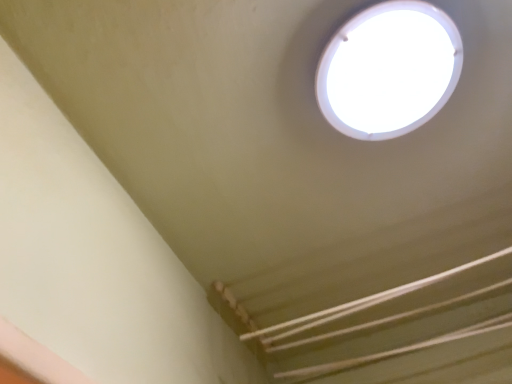
Image resolution: width=512 pixels, height=384 pixels. Describe the element at coordinates (389, 70) in the screenshot. I see `transparent glass window at upper right` at that location.

At what (x,y) coordinates should I click in order to perform the action: click on transparent glass window at upper right. Please return your answer as a coordinate pair (x, y). Looking at the image, I should click on (389, 70).

Where is `transparent glass window at upper right`? transparent glass window at upper right is located at coordinates (389, 70).